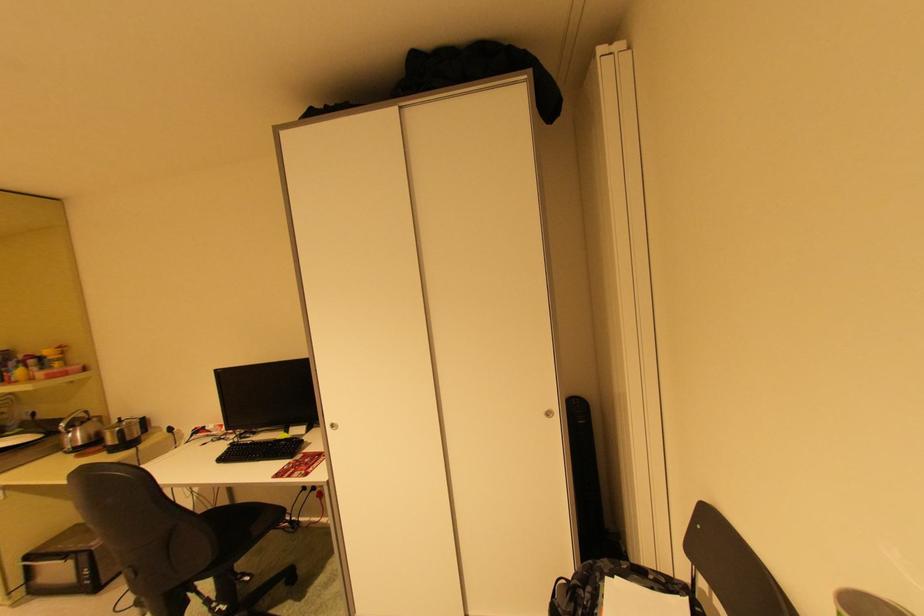
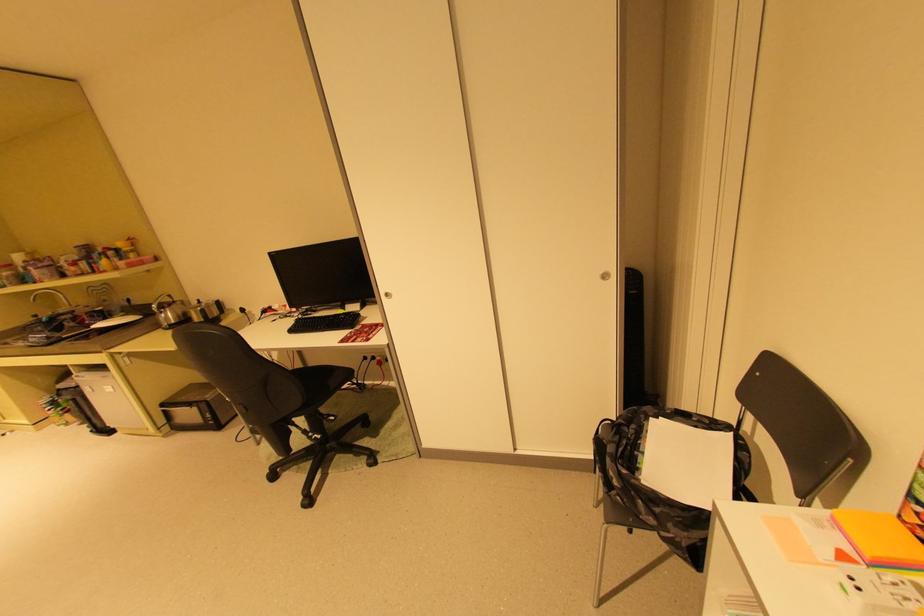
Find the pixel in the second image that matches pixel 229 562 in the first image.

(319, 408)